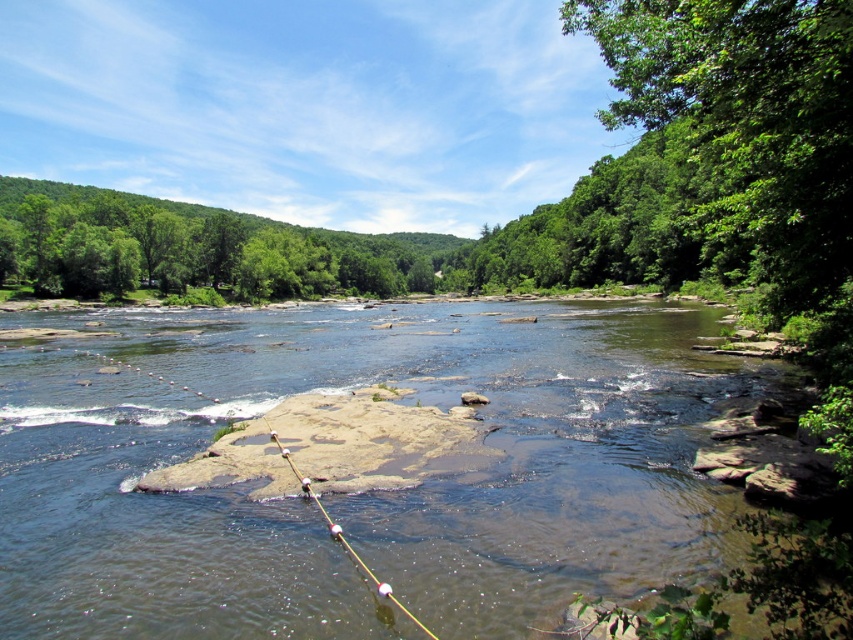
Question: From the image, what is the correct spatial relationship of brown rocky stream at center in relation to white plastic fishing pole at center?

Choices:
 (A) above
 (B) below

Answer: (A)

Question: Which point appears farthest from the camera in this image?

Choices:
 (A) (345, 545)
 (B) (738, 545)

Answer: (A)

Question: Is brown rocky stream at center closer to camera compared to white plastic fishing pole at center?

Choices:
 (A) no
 (B) yes

Answer: (A)

Question: Which point is closer to the camera taking this photo?

Choices:
 (A) (432, 518)
 (B) (277, 440)

Answer: (A)

Question: Which object is closer to the camera taking this photo?

Choices:
 (A) white plastic fishing pole at center
 (B) brown rocky stream at center

Answer: (A)

Question: Is brown rocky stream at center wider than white plastic fishing pole at center?

Choices:
 (A) no
 (B) yes

Answer: (B)